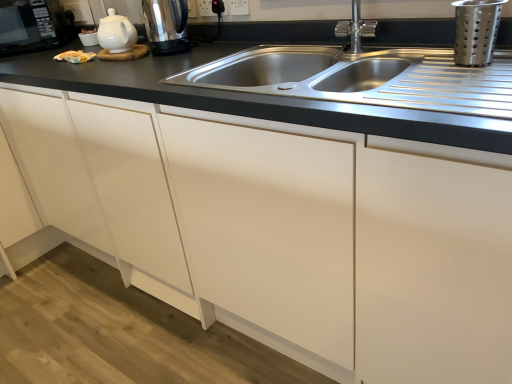
You are a GUI agent. You are given a task and a screenshot of the screen. Output one action in this format:
    pyautogui.click(x=<x>, y=<y>)
    Task: Click on the vacant area located to the right-hand side of polished stainless steel kettle at upper left
    This screenshot has width=512, height=384.
    Given the screenshot: What is the action you would take?
    pyautogui.click(x=219, y=51)